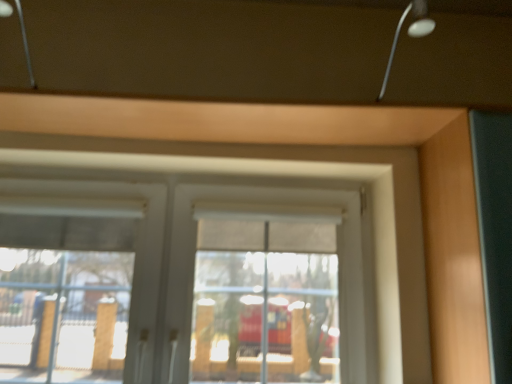
Question: Would you say metallic silver lamp at upper left, the 2th lamp positioned from the right, is to the left or to the right of matte wood garage door at right in the picture?

Choices:
 (A) right
 (B) left

Answer: (B)

Question: Considering the positions of metallic silver lamp at upper left, the 2th lamp positioned from the right, and matte wood garage door at right in the image, is metallic silver lamp at upper left, the 2th lamp positioned from the right, taller or shorter than matte wood garage door at right?

Choices:
 (A) short
 (B) tall

Answer: (A)

Question: Which is nearer to the metallic silver lamp at upper right, the 1th lamp in the right-to-left sequence?

Choices:
 (A) matte wood garage door at right
 (B) white matte window at center
 (C) metallic silver lamp at upper left, the 2th lamp positioned from the right

Answer: (A)

Question: Estimate the real-world distances between objects in this image. Which object is closer to the white matte window at center?

Choices:
 (A) metallic silver lamp at upper left, which appears as the 1th lamp when viewed from the left
 (B) matte wood garage door at right
 (C) metallic silver lamp at upper right, which is the 2th lamp from left to right

Answer: (B)